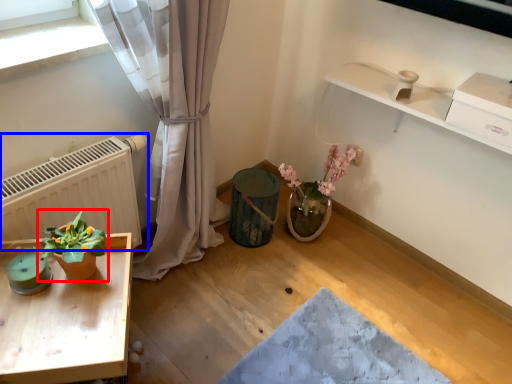
Question: Which object appears farthest to the camera in this image, houseplant (highlighted by a red box) or radiator (highlighted by a blue box)?

Choices:
 (A) houseplant
 (B) radiator

Answer: (B)